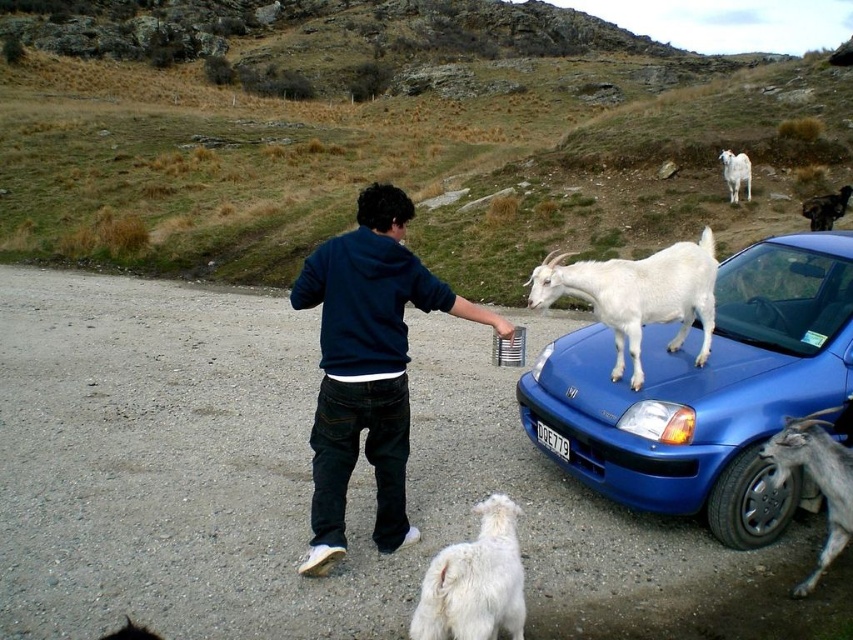
Who is more forward, (589, 294) or (814, 204)?

Positioned in front is point (589, 294).

Does point (697, 353) come farther from viewer compared to point (816, 204)?

No, it is not.

Who is more distant from viewer, (703,262) or (804,200)?

Point (804,200)

Locate an element on the screen. This screenshot has height=640, width=853. white woolen goat at center is located at coordinates (637, 294).

In the scene shown: Does white woolen goat at lower right lie in front of black fur dog at upper right?

Yes, white woolen goat at lower right is in front of black fur dog at upper right.

Can you confirm if white woolen goat at lower right is taller than black fur dog at upper right?

Yes, white woolen goat at lower right is taller than black fur dog at upper right.

Between point (839, 540) and point (834, 211), which one is positioned behind?

The point (834, 211) is behind.

Image resolution: width=853 pixels, height=640 pixels. Identify the location of white woolen goat at lower right. (816, 481).

Between blue glossy car at upper center and white woolen goat at center, which one is positioned lower?

blue glossy car at upper center is lower down.

Can you confirm if blue glossy car at upper center is positioned to the right of white woolen goat at center?

Correct, you'll find blue glossy car at upper center to the right of white woolen goat at center.

Describe the element at coordinates (706, 392) in the screenshot. This screenshot has height=640, width=853. I see `blue glossy car at upper center` at that location.

The image size is (853, 640). I want to click on blue glossy car at upper center, so click(706, 392).